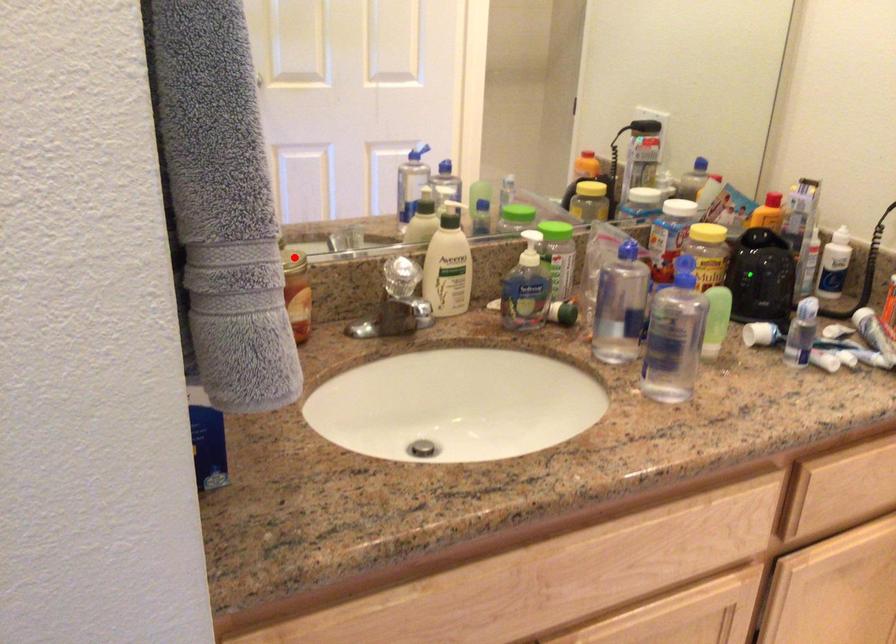
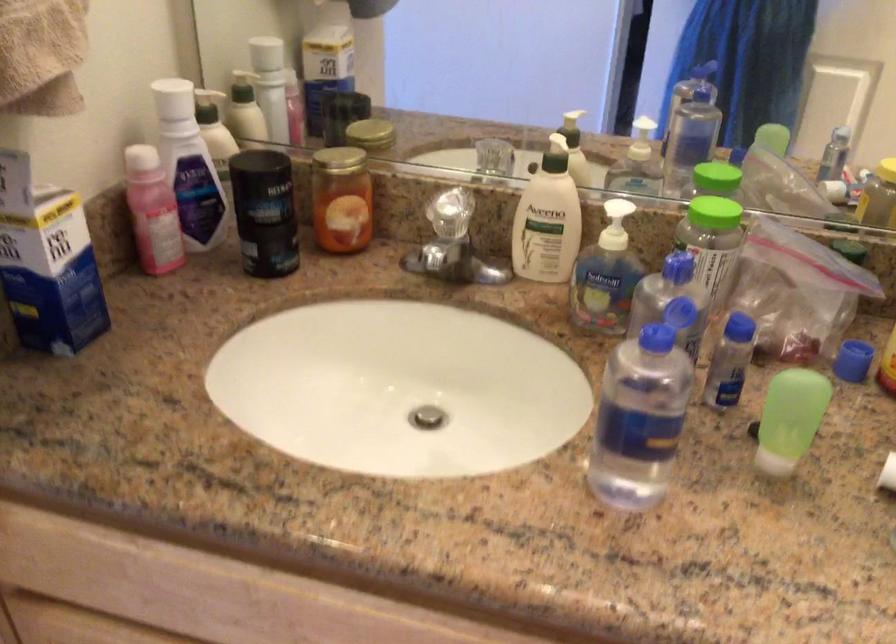
Where in the second image is the point corresponding to the highlighted location from the first image?

(336, 160)